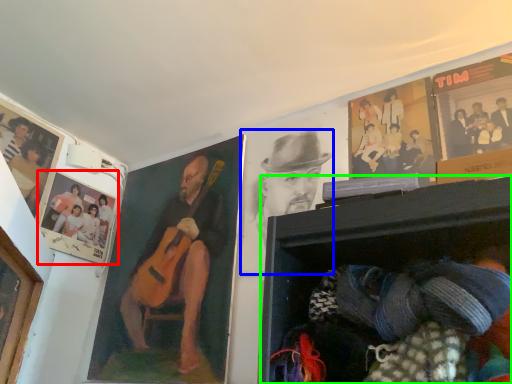
Question: Estimate the real-world distances between objects in this image. Which object is closer to picture frame (highlighted by a red box), man (highlighted by a blue box) or shelf (highlighted by a green box)?

Choices:
 (A) man
 (B) shelf

Answer: (A)